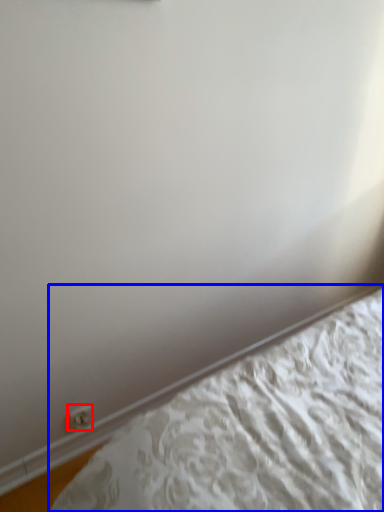
Question: Which object is closer to the camera taking this photo, electric outlet (highlighted by a red box) or bed (highlighted by a blue box)?

Choices:
 (A) electric outlet
 (B) bed

Answer: (B)